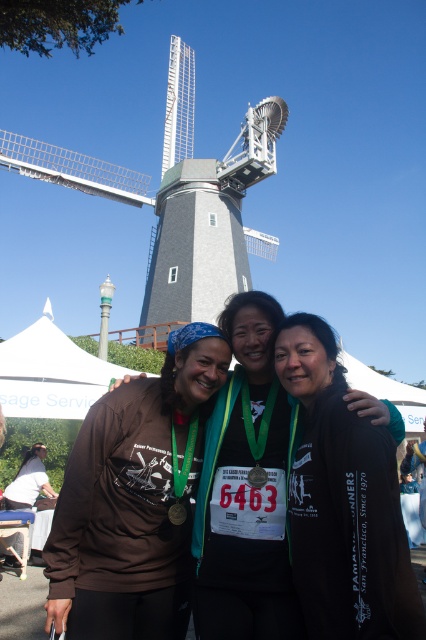
In the scene shown: You are a photographer trying to capture a group photo of the matte brown shirt at center and the gray wood windmill at upper center. Based on their sizes, which one should you focus on first to ensure both are in frame?

The matte brown shirt at center has a smaller size compared to the gray wood windmill at upper center, so you should focus on the matte brown shirt at center first to ensure both fit within the frame.

You are a photographer trying to capture a clear shot of the black matte jacket at center and the gray wood windmill at upper center. Which object will appear narrower in the photo?

The black matte jacket at center will appear narrower in the photo because it is thinner than the gray wood windmill at upper center.